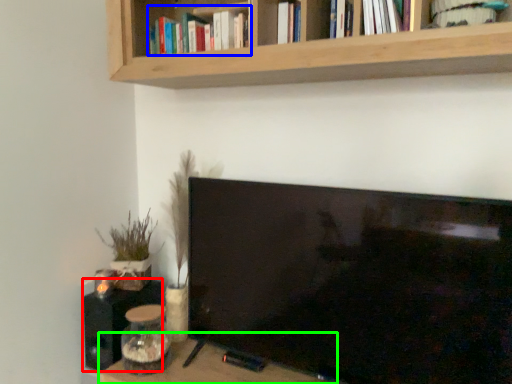
Question: Estimate the real-world distances between objects in this image. Which object is farther from speaker (highlighted by a red box), book (highlighted by a blue box) or table (highlighted by a green box)?

Choices:
 (A) book
 (B) table

Answer: (A)